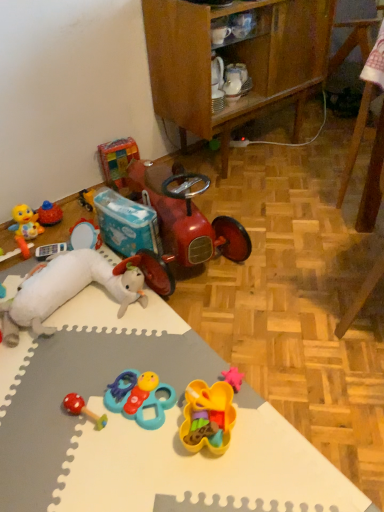
Image resolution: width=384 pixels, height=512 pixels. Find the location of `vacant space behind teal plastic toy at center, arranged as the 3th toy when viewed from the back`. vacant space behind teal plastic toy at center, arranged as the 3th toy when viewed from the back is located at coordinates (148, 348).